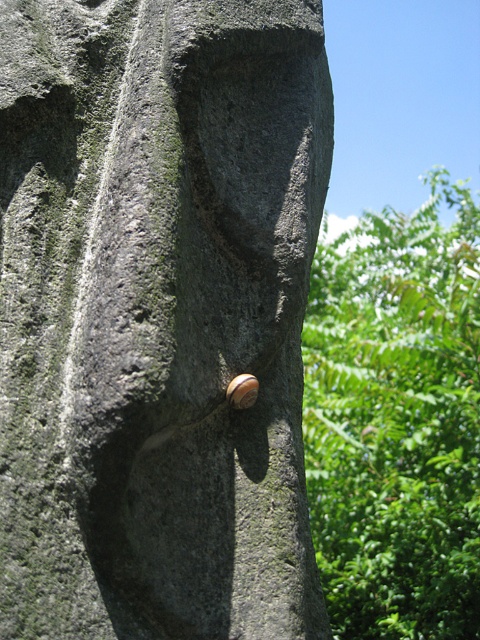
Question: Considering the relative positions of green leafy tree at upper right and shiny brown shell at center in the image provided, where is green leafy tree at upper right located with respect to shiny brown shell at center?

Choices:
 (A) right
 (B) left

Answer: (A)

Question: Which of the following is the closest to the observer?

Choices:
 (A) green leafy tree at upper right
 (B) shiny brown shell at center

Answer: (B)

Question: Which object is closer to the camera taking this photo?

Choices:
 (A) shiny brown shell at center
 (B) smooth gray stone at center
 (C) green leafy tree at upper right

Answer: (B)

Question: Can you confirm if smooth gray stone at center is smaller than shiny brown shell at center?

Choices:
 (A) yes
 (B) no

Answer: (B)

Question: Which point is farther to the camera?

Choices:
 (A) green leafy tree at upper right
 (B) shiny brown shell at center
 (C) smooth gray stone at center

Answer: (A)

Question: Is smooth gray stone at center wider than shiny brown shell at center?

Choices:
 (A) no
 (B) yes

Answer: (B)